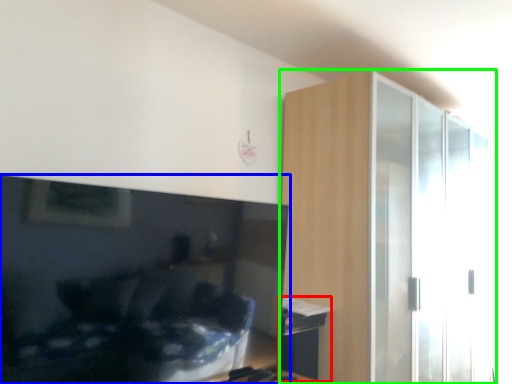
Question: Which is nearer to the table (highlighted by a red box)? television (highlighted by a blue box) or dresser (highlighted by a green box).

Choices:
 (A) television
 (B) dresser

Answer: (A)